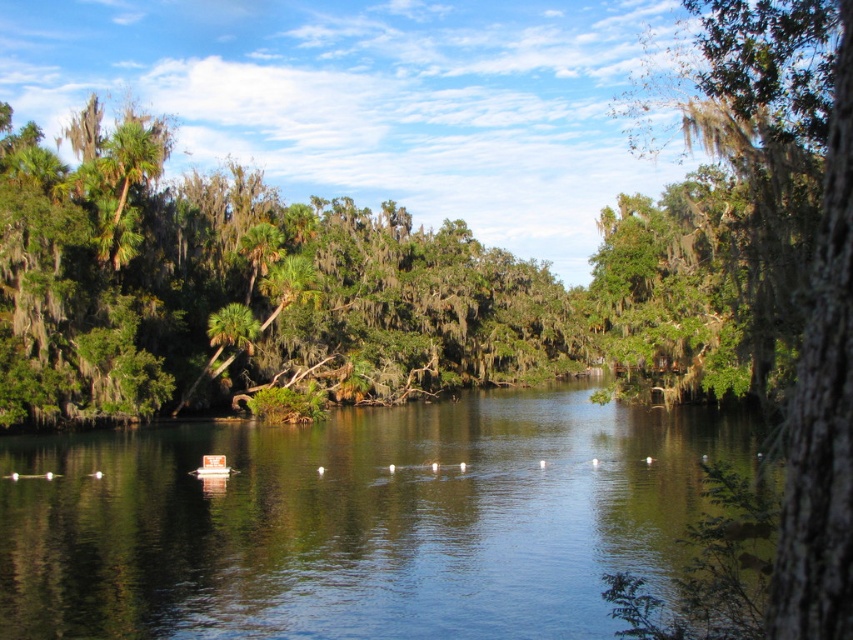
Question: Does green reflective water at center have a greater width compared to green mossy bark tree at right?

Choices:
 (A) yes
 (B) no

Answer: (A)

Question: Among these objects, which one is farthest from the camera?

Choices:
 (A) green mossy bark tree at right
 (B) green reflective water at center

Answer: (B)

Question: Can you confirm if green reflective water at center is wider than green mossy bark tree at right?

Choices:
 (A) yes
 (B) no

Answer: (A)

Question: Among these objects, which one is farthest from the camera?

Choices:
 (A) green reflective water at center
 (B) green mossy bark tree at right

Answer: (A)

Question: Can you confirm if green reflective water at center is positioned below green mossy bark tree at right?

Choices:
 (A) yes
 (B) no

Answer: (A)